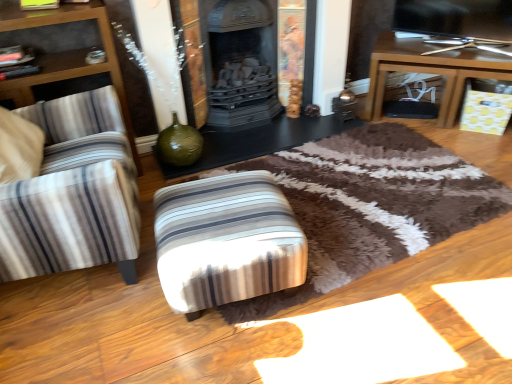
The height and width of the screenshot is (384, 512). What are the coordinates of `free point in front of black glossy table at center, which is the 2th table from right to left` in the screenshot? It's located at (318, 206).